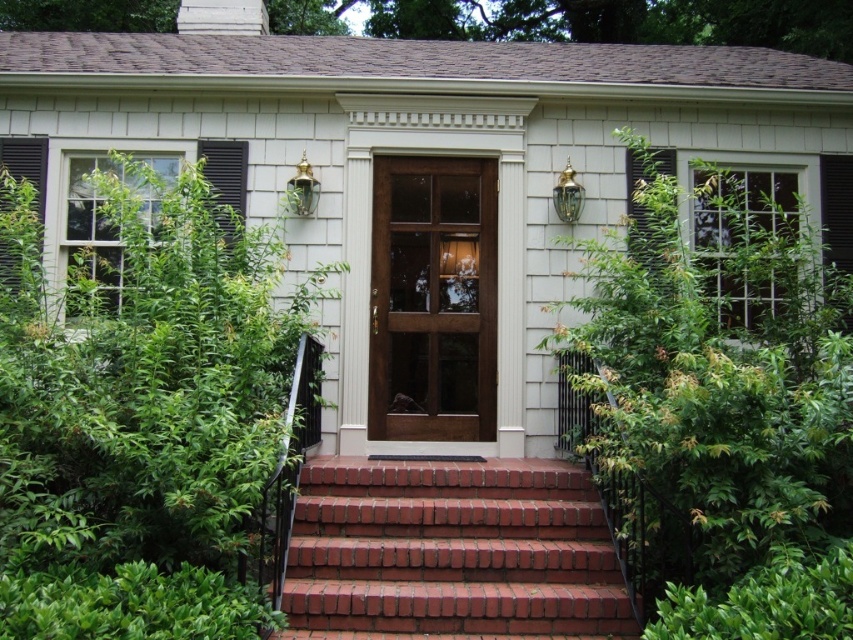
Question: Does green leafy bush at right appear under red brick stairs at center?

Choices:
 (A) no
 (B) yes

Answer: (A)

Question: Which of the following is the farthest from the observer?

Choices:
 (A) (215, 484)
 (B) (428, 166)

Answer: (B)

Question: Which object is the farthest from the green leafy plant at left?

Choices:
 (A) red brick stairs at center
 (B) green leafy bush at right
 (C) glossy wood door at center

Answer: (B)

Question: Which object is closer to the camera taking this photo?

Choices:
 (A) glossy wood door at center
 (B) green leafy bush at right
 (C) red brick stairs at center

Answer: (B)

Question: Does green leafy plant at left have a smaller size compared to red brick stairs at center?

Choices:
 (A) yes
 (B) no

Answer: (B)

Question: Is green leafy plant at left positioned before green leafy bush at right?

Choices:
 (A) no
 (B) yes

Answer: (A)